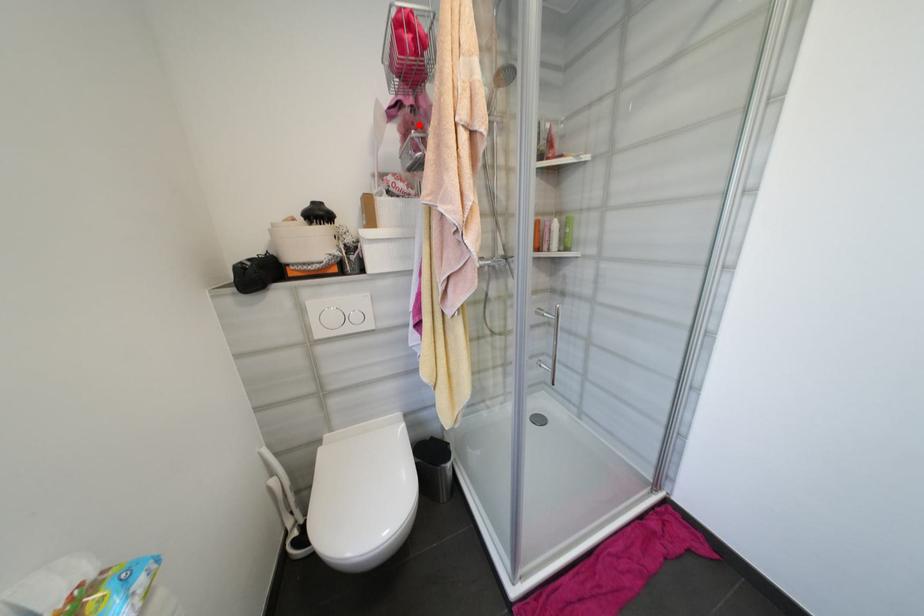
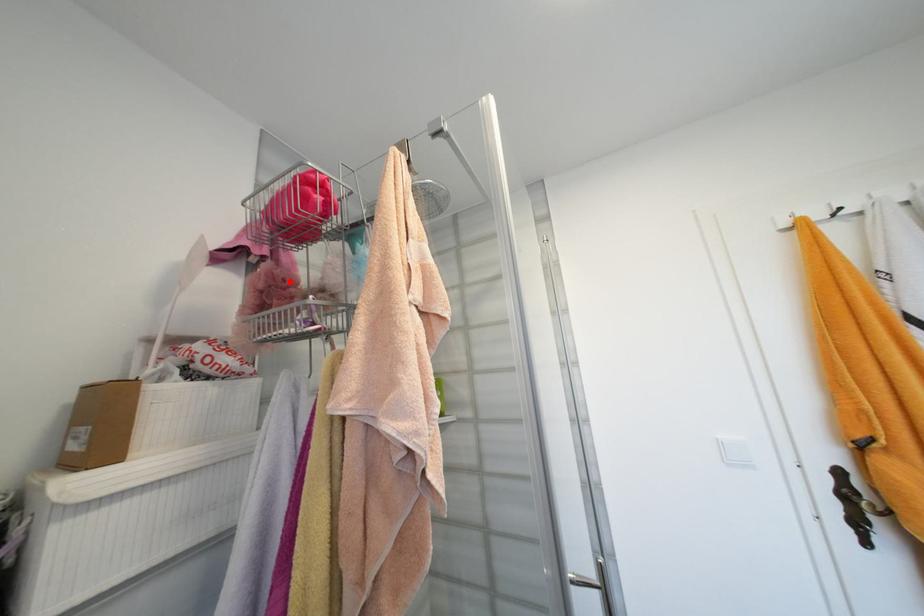
I am providing you with two images of the same scene from different viewpoints. A red point is marked on the first image and another point is marked on the second image. Does the point marked in image1 correspond to the same location as the one in image2?

Yes